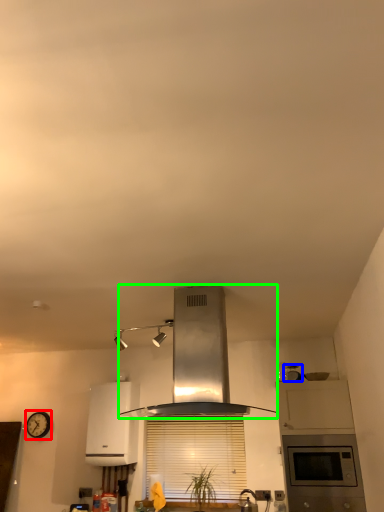
Question: Which object is positioned closest to clock (highlighted by a red box)? Select from appliance (highlighted by a blue box) and home appliance (highlighted by a green box).

Choices:
 (A) appliance
 (B) home appliance

Answer: (A)